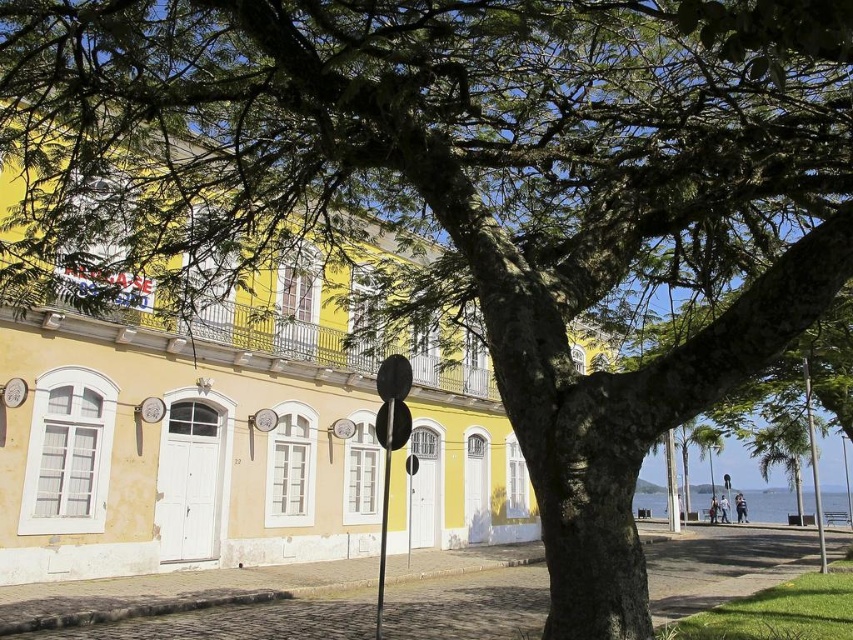
Question: Where is green leafy tree at lower right located in relation to metallic pole at right in the image?

Choices:
 (A) right
 (B) left

Answer: (B)

Question: Which point is farther to the camera?

Choices:
 (A) (821, 544)
 (B) (666, 508)
 (C) (384, 452)

Answer: (B)

Question: Which of the following is the closest to the observer?

Choices:
 (A) metallic pole at center-right
 (B) green leafy tree at lower right
 (C) metallic pole at right

Answer: (A)

Question: Is metallic pole at right further to camera compared to metallic pole at center-right?

Choices:
 (A) yes
 (B) no

Answer: (A)

Question: Does green leafy tree at lower right appear over metallic pole at center-right?

Choices:
 (A) yes
 (B) no

Answer: (B)

Question: Estimate the real-world distances between objects in this image. Which object is closer to the green leafy tree at lower right?

Choices:
 (A) black glossy pole at center
 (B) metallic pole at center-right

Answer: (B)